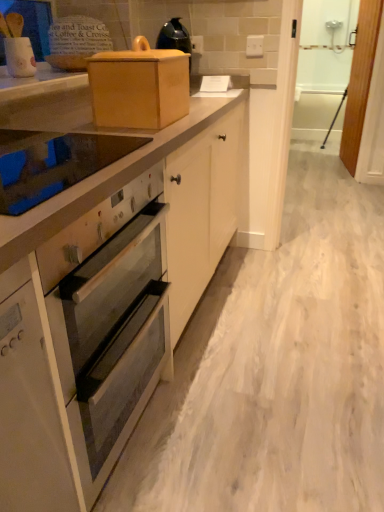
Question: Could you tell me if white wood screen door at right, which ranks as the 1th screen door in left-to-right order, is turned towards glass smooth cooktop at upper left?

Choices:
 (A) no
 (B) yes

Answer: (B)

Question: Is white wood screen door at right, marked as the 2th screen door in a right-to-left arrangement, next to glass smooth cooktop at upper left?

Choices:
 (A) no
 (B) yes

Answer: (A)

Question: Is white wood screen door at right, marked as the 2th screen door in a right-to-left arrangement, shorter than glass smooth cooktop at upper left?

Choices:
 (A) no
 (B) yes

Answer: (A)

Question: From a real-world perspective, is white wood screen door at right, which ranks as the 1th screen door in left-to-right order, below glass smooth cooktop at upper left?

Choices:
 (A) yes
 (B) no

Answer: (A)

Question: From the image's perspective, is white wood screen door at right, marked as the 2th screen door in a right-to-left arrangement, below glass smooth cooktop at upper left?

Choices:
 (A) yes
 (B) no

Answer: (B)

Question: Looking at their shapes, would you say white glossy oven at center is wider or thinner than wooden box at upper center?

Choices:
 (A) wide
 (B) thin

Answer: (A)

Question: Is point (165, 274) closer or farther from the camera than point (142, 37)?

Choices:
 (A) closer
 (B) farther

Answer: (A)

Question: From the image's perspective, is white glossy oven at center located above or below wooden box at upper center?

Choices:
 (A) below
 (B) above

Answer: (A)

Question: In terms of size, does white glossy oven at center appear bigger or smaller than wooden box at upper center?

Choices:
 (A) small
 (B) big

Answer: (B)

Question: Considering the positions of point (89, 305) and point (347, 100), is point (89, 305) closer or farther from the camera than point (347, 100)?

Choices:
 (A) closer
 (B) farther

Answer: (A)

Question: From the image's perspective, relative to wooden screen door at right, the first screen door viewed from the right, is white glossy oven at center above or below?

Choices:
 (A) above
 (B) below

Answer: (B)

Question: In terms of width, does white glossy oven at center look wider or thinner when compared to wooden screen door at right, marked as the second screen door in a left-to-right arrangement?

Choices:
 (A) thin
 (B) wide

Answer: (B)

Question: Relative to wooden screen door at right, the first screen door viewed from the right, is white glossy oven at center in front or behind?

Choices:
 (A) behind
 (B) front

Answer: (B)

Question: Based on their sizes in the image, would you say white glossy oven at center is bigger or smaller than white wood screen door at right, marked as the 2th screen door in a right-to-left arrangement?

Choices:
 (A) big
 (B) small

Answer: (A)

Question: From the image's perspective, relative to white wood screen door at right, marked as the 2th screen door in a right-to-left arrangement, is white glossy oven at center above or below?

Choices:
 (A) below
 (B) above

Answer: (A)